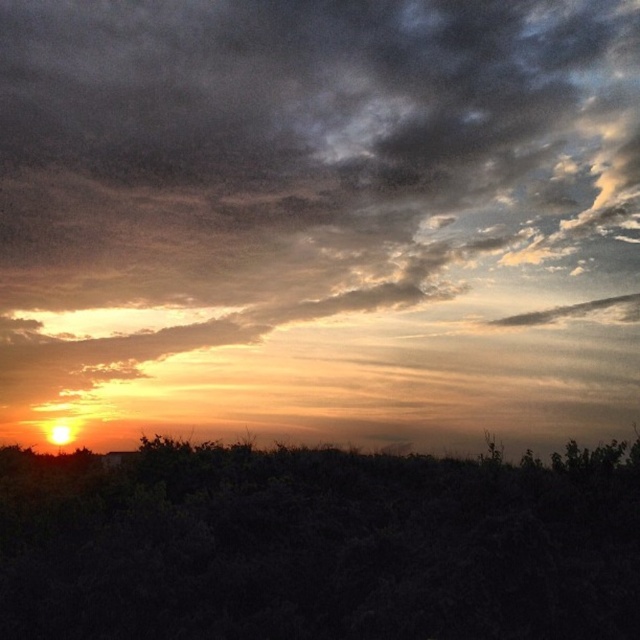
You are an astronomer observing the sunset. You notice the cloudy sky at upper center and the orange matte horizon at lower center. Which object is located to the right of the other?

The cloudy sky at upper center is positioned on the right side of orange matte horizon at lower center.

You are an astronomer observing the sunset. You notice the cloudy sky at upper center and the orange matte horizon at lower center. Which object is located above the other?

The cloudy sky at upper center is positioned over the orange matte horizon at lower center, meaning it is above it.